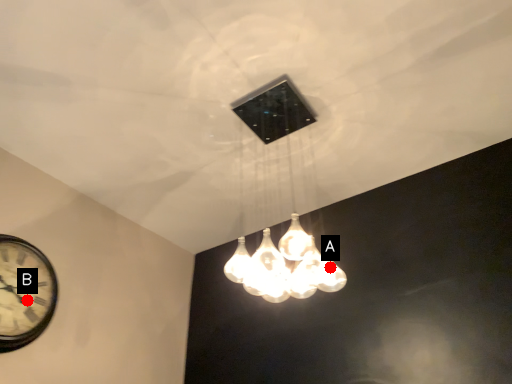
Question: Two points are circled on the image, labeled by A and B beside each circle. Which point is closer to the camera?

Choices:
 (A) A is closer
 (B) B is closer

Answer: (A)